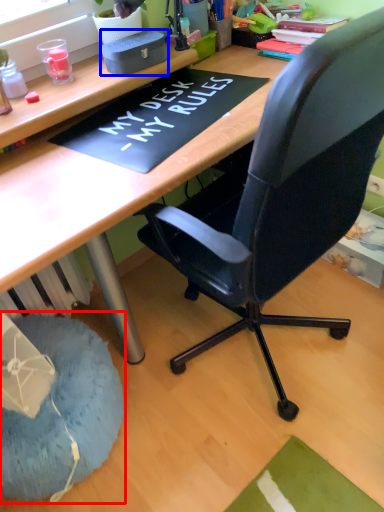
Question: Which object appears farthest to the camera in this image, bean bag chair (highlighted by a red box) or stationery (highlighted by a blue box)?

Choices:
 (A) bean bag chair
 (B) stationery

Answer: (B)